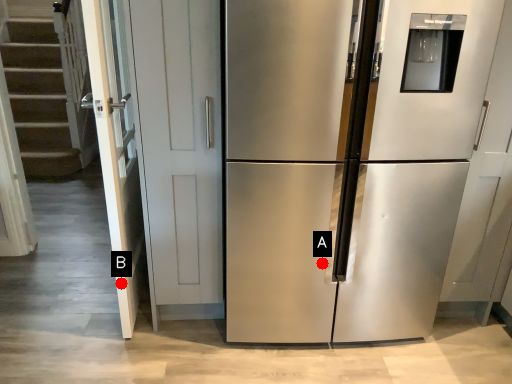
Question: Two points are circled on the image, labeled by A and B beside each circle. Among these points, which one is farthest from the camera?

Choices:
 (A) A is further
 (B) B is further

Answer: (B)